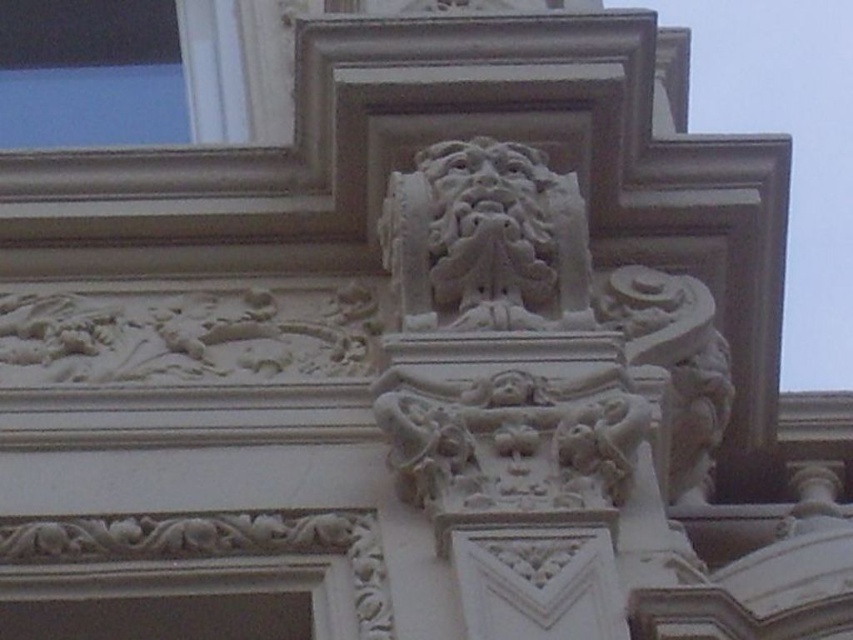
Question: Which object is closer to the camera taking this photo?

Choices:
 (A) white stone sculpture at center
 (B) white stone sculpture at upper center
 (C) transparent glass window at upper left

Answer: (A)

Question: Can you confirm if white stone sculpture at center is positioned below white stone sculpture at upper center?

Choices:
 (A) yes
 (B) no

Answer: (A)

Question: Which of the following is the farthest from the observer?

Choices:
 (A) transparent glass window at upper left
 (B) white stone sculpture at center

Answer: (A)

Question: Which point is farther to the camera?

Choices:
 (A) white stone sculpture at upper center
 (B) transparent glass window at upper left

Answer: (B)

Question: From the image, what is the correct spatial relationship of white stone sculpture at center in relation to white stone sculpture at upper center?

Choices:
 (A) above
 (B) below

Answer: (B)

Question: In this image, where is white stone sculpture at center located relative to white stone sculpture at upper center?

Choices:
 (A) below
 (B) above

Answer: (A)